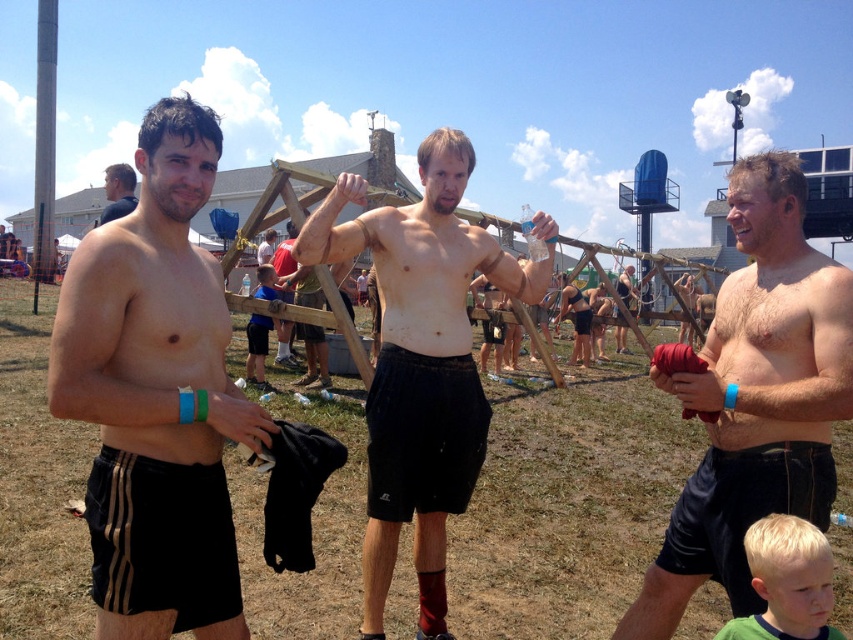
You are a photographer trying to capture a closeup of the smooth skin torso at center and the matte black shorts at center. Based on their widths, which object should you zoom in on first to ensure proper framing?

The smooth skin torso at center might be wider than the matte black shorts at center, so you should zoom in on the smooth skin torso at center first to ensure proper framing.

You are a photographer at the event and want to capture a closeup of the blonde hair at lower right and the matte black shorts at left. Which object should you zoom in on more to ensure both are in focus?

Since the blonde hair at lower right occupies less space than the matte black shorts at left, you should zoom in more on the blonde hair at lower right to ensure both are in focus.